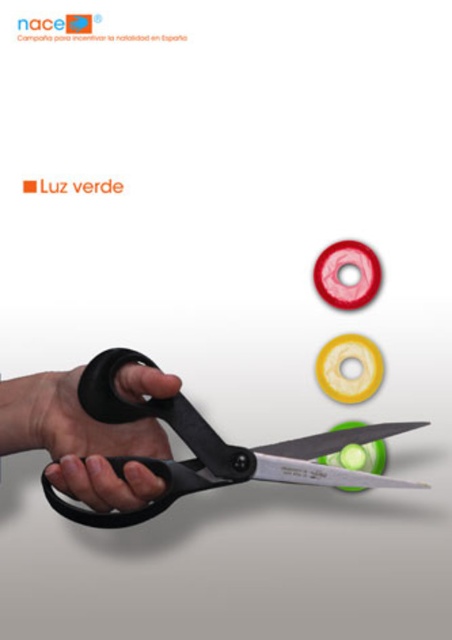
Does black plastic scissors at center appear under black matte scissors at center?

Correct, black plastic scissors at center is located below black matte scissors at center.

Between point (149, 508) and point (56, 419), which one is positioned in front?

Point (149, 508)

Which is in front, point (335, 476) or point (122, 378)?

Point (122, 378) is more forward.

Where is `black plastic scissors at center`? black plastic scissors at center is located at coordinates (208, 448).